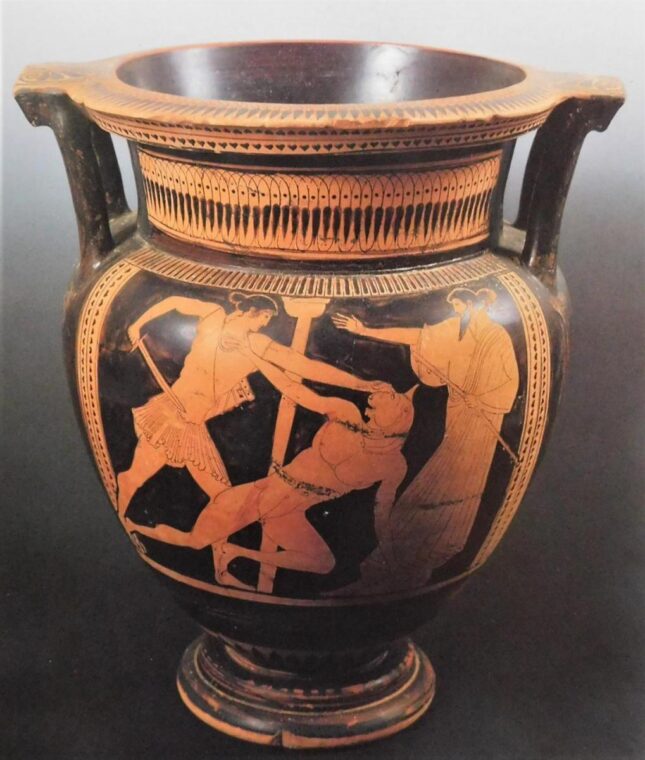
Identify the location of brown pottery. (94, 355).